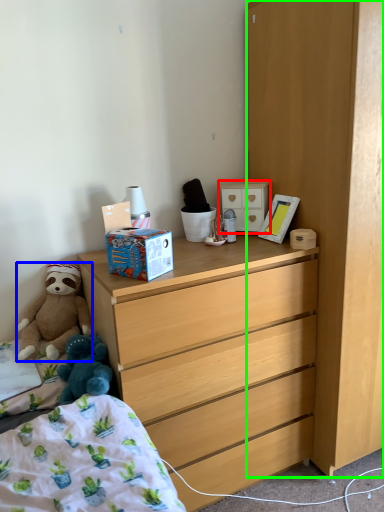
Question: Estimate the real-world distances between objects in this image. Which object is closer to cabinetry (highlighted by a red box), teddy bear (highlighted by a blue box) or cabinetry (highlighted by a green box)?

Choices:
 (A) teddy bear
 (B) cabinetry

Answer: (B)